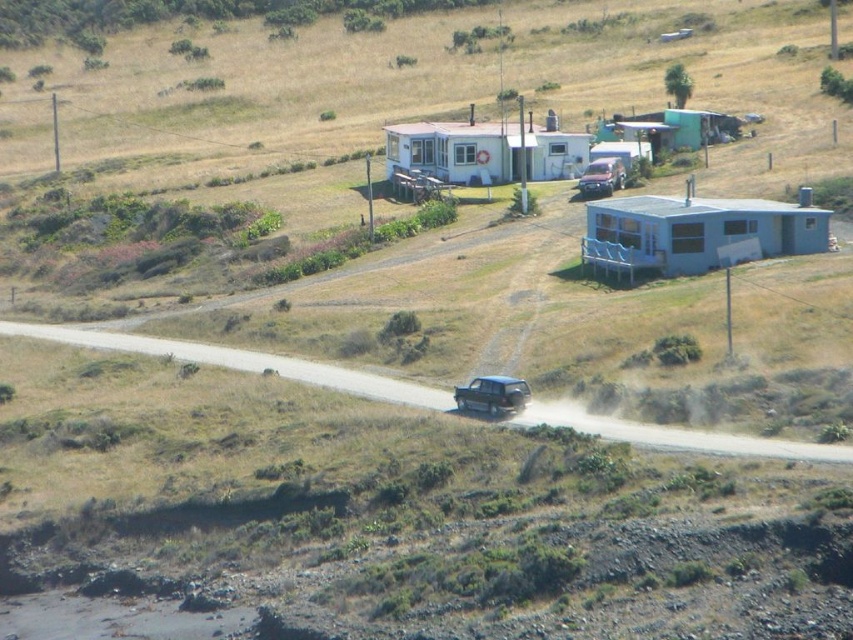
You are planning to drive a metallic silver suv at center along the brown dirt track at center. Considering their sizes, will the suv fit comfortably on the track?

The brown dirt track at center is larger in size than the metallic silver suv at center, so the suv will fit comfortably on the track.

You are standing at the origin point of the image. Which direction should you walk to reach the brown dirt track at center?

Since the brown dirt track at center is located at coordinate point 0.567 on the x axis and 0.284 on the y axis, you should walk towards the northeast direction to reach it.

You are driving a satin black suv at center and want to turn left onto the brown dirt track at center. Is the track positioned to allow a left turn from your current direction?

The brown dirt track at center is to the left of the satin black suv at center, so yes, the track is positioned to allow a left turn from your current direction.